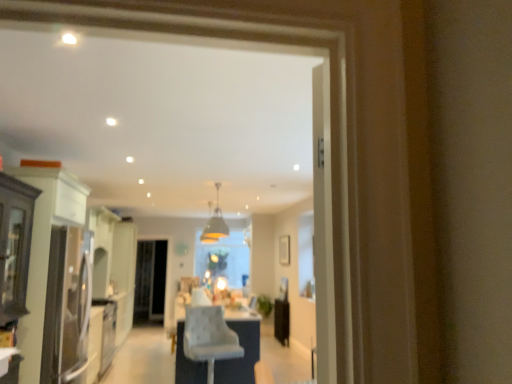
What are the coordinates of `clear glass screen door at center` in the screenshot? It's located at (150, 282).

Where is `light gray fabric chair at center`? This screenshot has height=384, width=512. light gray fabric chair at center is located at coordinates (209, 337).

Measure the distance between point (223, 359) and camera.

A distance of 4.46 meters exists between point (223, 359) and camera.

What do you see at coordinates (215, 224) in the screenshot?
I see `matte gold pendant light at center` at bounding box center [215, 224].

Locate an element on the screen. The image size is (512, 384). matte gold pendant light at center is located at coordinates [x=215, y=224].

Identify the location of clear glass screen door at center. (150, 282).

Does clear glass screen door at center have a smaller size compared to matte white cabinet at left?

Indeed, clear glass screen door at center has a smaller size compared to matte white cabinet at left.

Is clear glass screen door at center turned away from matte white cabinet at left?

No, clear glass screen door at center is not facing the opposite direction of matte white cabinet at left.

Is matte white cabinet at left located within clear glass screen door at center?

No.

Is point (138, 261) positioned behind point (35, 335)?

That is True.

How different are the orientations of matte gold pendant light at center and clear glass screen door at center in degrees?

matte gold pendant light at center and clear glass screen door at center are facing 2.94 degrees away from each other.

Is matte gold pendant light at center located outside clear glass screen door at center?

That's correct, matte gold pendant light at center is outside of clear glass screen door at center.

Is point (211, 227) positioned behind point (136, 303)?

Yes, it is.

Which object is further away from the camera taking this photo, matte white cabinet at left or light gray fabric chair at center?

light gray fabric chair at center.

Consider the image. Is light gray fabric chair at center completely or partially inside matte white cabinet at left?

No, light gray fabric chair at center is not a part of matte white cabinet at left.

Image resolution: width=512 pixels, height=384 pixels. Identify the location of cabinetry above the light gray fabric chair at center (from a real-world perspective). (44, 250).

Considering the relative sizes of matte white cabinet at left and clear glass screen door at center in the image provided, is matte white cabinet at left bigger than clear glass screen door at center?

Correct, matte white cabinet at left is larger in size than clear glass screen door at center.

Can clear glass screen door at center be found inside matte white cabinet at left?

No, clear glass screen door at center is not inside matte white cabinet at left.

How distant is matte white cabinet at left from clear glass screen door at center?

matte white cabinet at left is 5.70 meters away from clear glass screen door at center.

Looking at this image, is matte white cabinet at left facing towards clear glass screen door at center?

No, matte white cabinet at left is not facing towards clear glass screen door at center.

Does matte gold pendant light at center have a lesser width compared to matte white cabinet at left?

Yes.

How much distance is there between matte gold pendant light at center and matte white cabinet at left?

19.06 feet.

From the image's perspective, is matte gold pendant light at center over matte white cabinet at left?

Yes.

Looking at this image, is matte gold pendant light at center positioned beyond the bounds of matte white cabinet at left?

Indeed, matte gold pendant light at center is completely outside matte white cabinet at left.

Is light gray fabric chair at center located outside matte gold pendant light at center?

Yes, light gray fabric chair at center is outside of matte gold pendant light at center.

Does light gray fabric chair at center have a greater height compared to matte gold pendant light at center?

Yes, light gray fabric chair at center is taller than matte gold pendant light at center.

Can you confirm if light gray fabric chair at center is positioned to the right of matte gold pendant light at center?

Yes, light gray fabric chair at center is to the right of matte gold pendant light at center.

Can you confirm if light gray fabric chair at center is bigger than matte gold pendant light at center?

Yes.

From the image's perspective, relative to light gray fabric chair at center, is matte gold pendant light at center above or below?

Clearly, from the image's perspective, matte gold pendant light at center is above light gray fabric chair at center.

Considering the sizes of objects matte gold pendant light at center and light gray fabric chair at center in the image provided, who is wider, matte gold pendant light at center or light gray fabric chair at center?

light gray fabric chair at center.

How many degrees apart are the facing directions of matte gold pendant light at center and light gray fabric chair at center?

The angle between the facing direction of matte gold pendant light at center and the facing direction of light gray fabric chair at center is 13 degrees.

I want to click on light fixture to the left of light gray fabric chair at center, so click(x=215, y=224).

Find the location of a particular element. screen door to the left of matte white cabinet at left is located at coordinates (150, 282).

Identify the location of light fixture located above the clear glass screen door at center (from the image's perspective). This screenshot has width=512, height=384. (215, 224).

When comparing their distances from clear glass screen door at center, does light gray fabric chair at center or matte gold pendant light at center seem further?

light gray fabric chair at center is positioned further to the anchor clear glass screen door at center.

Estimate the real-world distances between objects in this image. Which object is closer to matte gold pendant light at center, light gray fabric chair at center or clear glass screen door at center?

clear glass screen door at center is positioned closer to the anchor matte gold pendant light at center.

Consider the image. Which object lies nearer to the anchor point clear glass screen door at center, matte gold pendant light at center or light gray fabric chair at center?

matte gold pendant light at center lies closer to clear glass screen door at center than the other object.

From the picture: From the image, which object appears to be farther from matte white cabinet at left, clear glass screen door at center or light gray fabric chair at center?

Among the two, clear glass screen door at center is located further to matte white cabinet at left.

Considering their positions, is clear glass screen door at center positioned further to matte white cabinet at left than matte gold pendant light at center?

matte gold pendant light at center is positioned further to the anchor matte white cabinet at left.

In the scene shown: Considering their positions, is matte gold pendant light at center positioned closer to clear glass screen door at center than matte white cabinet at left?

Based on the image, matte gold pendant light at center appears to be nearer to clear glass screen door at center.

Considering their positions, is matte white cabinet at left positioned closer to light gray fabric chair at center than matte gold pendant light at center?

The object closer to light gray fabric chair at center is matte white cabinet at left.

Estimate the real-world distances between objects in this image. Which object is further from matte gold pendant light at center, matte white cabinet at left or light gray fabric chair at center?

The object further to matte gold pendant light at center is matte white cabinet at left.

The width and height of the screenshot is (512, 384). I want to click on chair between matte white cabinet at left and matte gold pendant light at center from front to back, so click(209, 337).

Where is `light fixture positioned between light gray fabric chair at center and clear glass screen door at center from near to far`? light fixture positioned between light gray fabric chair at center and clear glass screen door at center from near to far is located at coordinates (215, 224).

Identify the location of light fixture located between matte white cabinet at left and clear glass screen door at center in the depth direction. This screenshot has width=512, height=384. (215, 224).

Where is `chair between matte white cabinet at left and clear glass screen door at center from front to back`? chair between matte white cabinet at left and clear glass screen door at center from front to back is located at coordinates (209, 337).